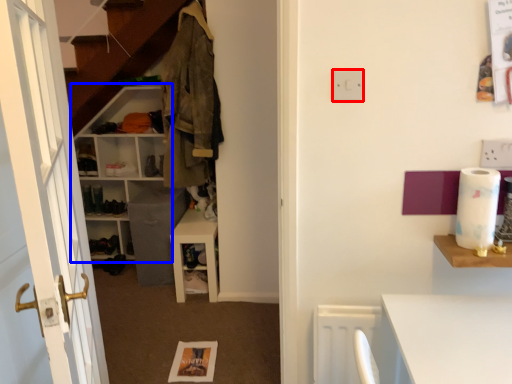
Question: Which of the following is the farthest to the observer, electric outlet (highlighted by a red box) or shelf (highlighted by a blue box)?

Choices:
 (A) electric outlet
 (B) shelf

Answer: (B)